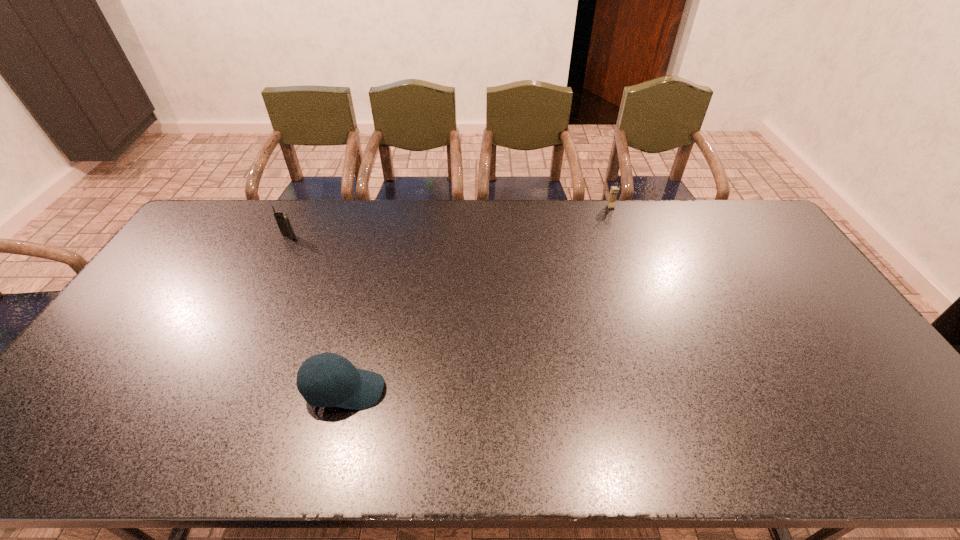
This screenshot has height=540, width=960. I want to click on vacant area that lies between the baseball cap and the second farthest object, so click(x=317, y=313).

You are a GUI agent. You are given a task and a screenshot of the screen. Output one action in this format:
    pyautogui.click(x=<x>, y=<y>)
    Task: Click on the free space between the right cellular telephone and the left cellular telephone
    The image size is (960, 540).
    Given the screenshot: What is the action you would take?
    pyautogui.click(x=450, y=222)

Locate an element on the screen. free space between the second object from right to left and the right cellular telephone is located at coordinates (478, 299).

Locate an element on the screen. object that is the second closest to the left cellular telephone is located at coordinates (614, 190).

Choose which object is the second nearest neighbor to the leftmost object. Please provide its 2D coordinates. Your answer should be formatted as a tuple, i.e. [(x, y)], where the tuple contains the x and y coordinates of a point satisfying the conditions above.

[(614, 190)]

The image size is (960, 540). What are the coordinates of `free spot that satisfies the following two spatial constraints: 1. on the front of the farthest object, where the keypad is located; 2. on the front-facing side of the second object from left to right` in the screenshot? It's located at (678, 390).

At what (x,y) coordinates should I click in order to perform the action: click on free space that satisfies the following two spatial constraints: 1. on the front of the farther cellular telephone, where the keypad is located; 2. on the front-facing side of the nearest object. Please return your answer as a coordinate pair (x, y). Image resolution: width=960 pixels, height=540 pixels. Looking at the image, I should click on (678, 390).

Locate an element on the screen. free point that satisfies the following two spatial constraints: 1. on the front of the right cellular telephone, where the keypad is located; 2. on the front-facing side of the second object from right to left is located at coordinates (678, 390).

Locate an element on the screen. Image resolution: width=960 pixels, height=540 pixels. free space that satisfies the following two spatial constraints: 1. on the front of the farther cellular telephone, where the keypad is located; 2. on the front-facing side of the nearest object is located at coordinates pyautogui.click(x=678, y=390).

Find the location of `free region that satisfies the following two spatial constraints: 1. on the front of the farthest object, where the keypad is located; 2. on the front-facing side of the baseball cap`. free region that satisfies the following two spatial constraints: 1. on the front of the farthest object, where the keypad is located; 2. on the front-facing side of the baseball cap is located at coordinates (678, 390).